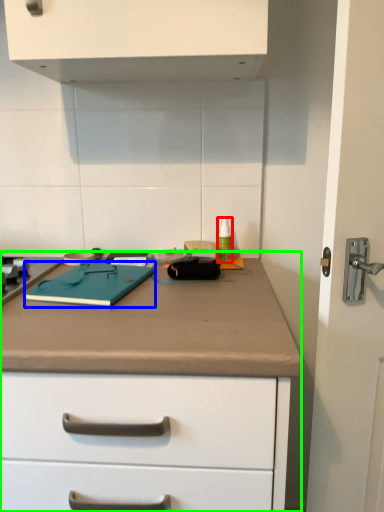
Question: Considering the real-world distances, which object is closest to bottle (highlighted by a red box)? notebook (highlighted by a blue box) or counter (highlighted by a green box).

Choices:
 (A) notebook
 (B) counter

Answer: (A)